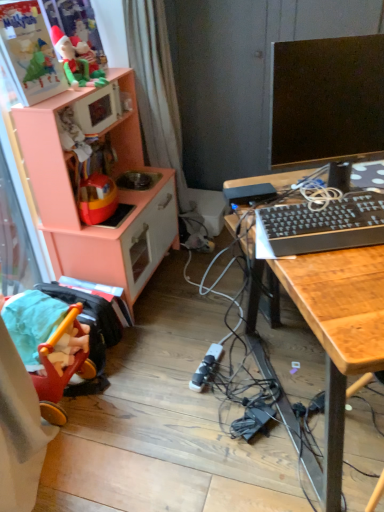
Locate an element on the screen. vacant space to the right of black plastic plug at center is located at coordinates (240, 367).